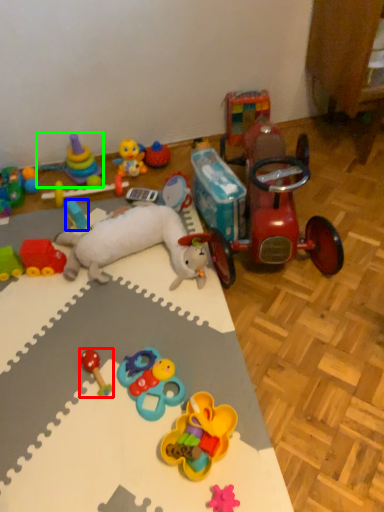
Question: Estimate the real-world distances between objects in this image. Which object is closer to toy (highlighted by a red box), toy (highlighted by a blue box) or toy (highlighted by a green box)?

Choices:
 (A) toy
 (B) toy

Answer: (A)